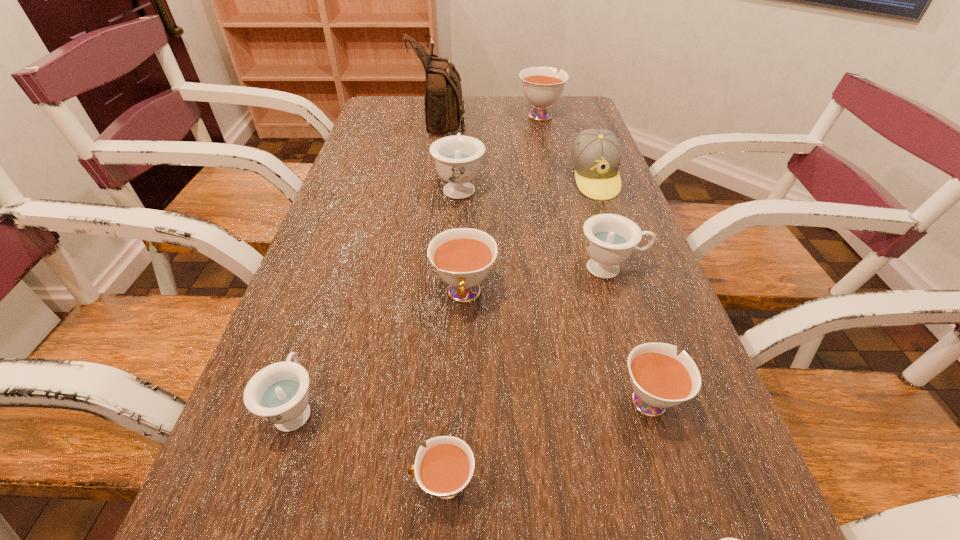
Image resolution: width=960 pixels, height=540 pixels. Identify the location of vacant region located on the side of the third farthest white teacup with the handle. (606, 263).

What are the coordinates of `blank area located on the side of the third farthest white teacup with the handle` in the screenshot? It's located at (627, 331).

What are the coordinates of `vacant area situated on the side of the third farthest white teacup with the handle` in the screenshot? It's located at (603, 251).

At what (x,y) coordinates should I click in order to perform the action: click on free space located 0.100m on the side of the second nearest blue teacup with the handle. Please return your answer as a coordinate pair (x, y). The width and height of the screenshot is (960, 540). Looking at the image, I should click on pos(321,330).

This screenshot has width=960, height=540. I want to click on vacant position located on the side of the second nearest blue teacup with the handle, so [335, 288].

You are a GUI agent. You are given a task and a screenshot of the screen. Output one action in this format:
    pyautogui.click(x=<x>, y=<y>)
    Task: Click on the blank space located 0.270m on the side of the second nearest blue teacup with the handle
    The image size is (960, 540).
    Given the screenshot: What is the action you would take?
    (342, 268)

Find the location of a particular element. Image resolution: width=960 pixels, height=540 pixels. blank space located 0.060m on the side of the seventh farthest teacup with the handle is located at coordinates (369, 485).

At what (x,y) coordinates should I click in order to perform the action: click on free location located on the side of the seventh farthest teacup with the handle. Please return your answer as a coordinate pair (x, y). This screenshot has width=960, height=540. Looking at the image, I should click on click(x=270, y=485).

The width and height of the screenshot is (960, 540). Find the location of `vacant area situated 0.060m on the side of the seventh farthest teacup with the handle`. vacant area situated 0.060m on the side of the seventh farthest teacup with the handle is located at coordinates (369, 485).

Where is `shoulder bag present at the far edge`? shoulder bag present at the far edge is located at coordinates (444, 105).